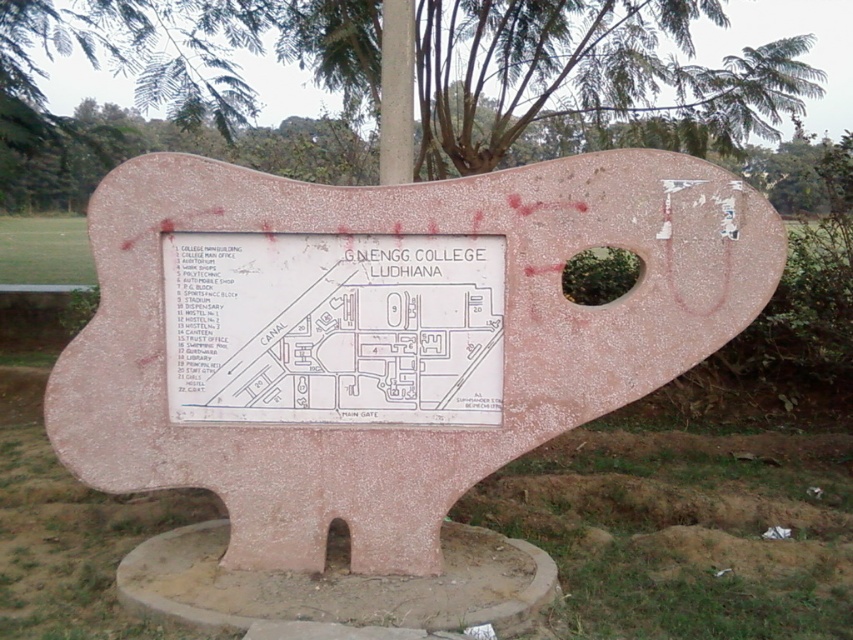
Question: Estimate the real-world distances between objects in this image. Which object is closer to the white stone map at center?

Choices:
 (A) pink stone map at center
 (B) metallic pole at upper center

Answer: (A)

Question: Which object appears closest to the camera in this image?

Choices:
 (A) metallic pole at upper center
 (B) green leafy tree at upper center
 (C) white stone map at center

Answer: (C)

Question: Can you confirm if green leafy tree at upper center is wider than metallic pole at upper center?

Choices:
 (A) yes
 (B) no

Answer: (A)

Question: Estimate the real-world distances between objects in this image. Which object is closer to the pink stone map at center?

Choices:
 (A) metallic pole at upper center
 (B) green leafy tree at upper center

Answer: (A)

Question: Is pink stone map at center to the left of white stone map at center from the viewer's perspective?

Choices:
 (A) yes
 (B) no

Answer: (B)

Question: Is pink stone map at center to the left of metallic pole at upper center from the viewer's perspective?

Choices:
 (A) yes
 (B) no

Answer: (B)